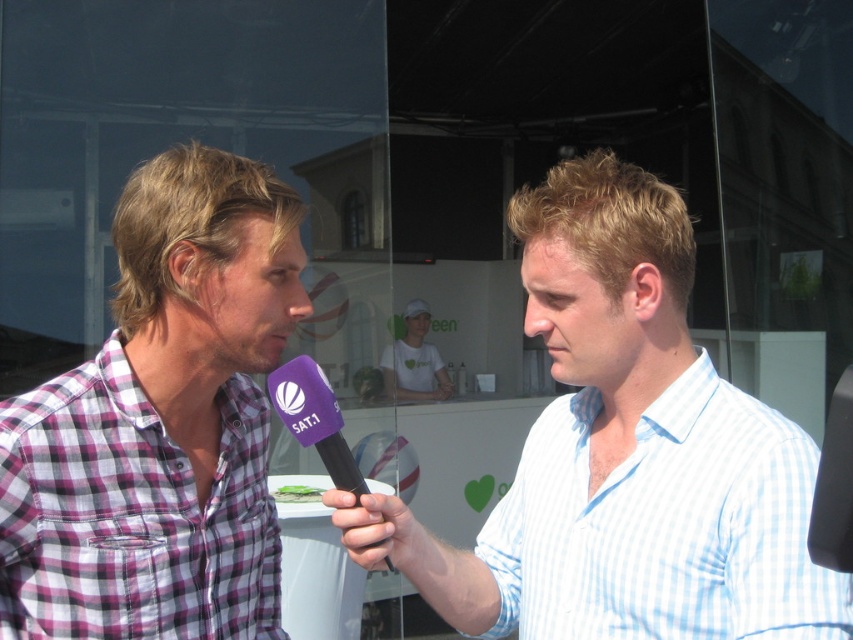
You are a photographer positioned at point (x=314, y=419). You need to capture a photo of the purple matte microphone at center. Is the purple matte microphone at center within your current field of view?

The purple matte microphone at center is located exactly at point (x=314, y=419), so yes, it is within your current field of view as you are positioned at that point.

You are a photographer standing at the camera position. You want to place a small sticker exactly at point [740,632] in the image. The sticker has a diameter of 0.5 feet. Will the sticker fit without overlapping any objects in the scene?

The distance of point [740,632] from camera is 3.50 feet. Since the sticker has a diameter of 0.5 feet, it can be placed there as long as there is enough space. However, without knowing the exact dimensions and positions of surrounding objects, we can only confirm the distance from the camera. The sticker might fit, but potential overlaps cannot be guaranteed based on the provided information.

You are a photographer standing at the camera position. You want to take a photo of the interviewee wearing the light blue and white striped shirt. However, there is an obstacle at point (761,593) that is 1.07 meters away from you. Can you move closer to the interviewee to avoid the obstacle?

The obstacle at point (761,593) is 1.07 meters away from the camera. To avoid it, you can move closer to the interviewee, as the distance to the interviewee is not specified, but the obstacle is only 1.07 meters away. Moving forward past the obstacle might allow you to take the photo without obstruction.